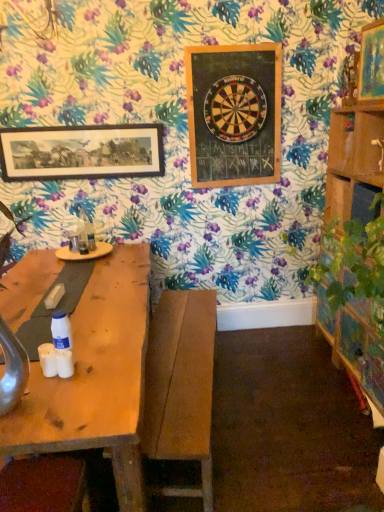
Locate an element on the screen. blank space above wooden bench at center, placed as the first swivel chair when sorted from back to front (from a real-world perspective) is located at coordinates (181, 350).